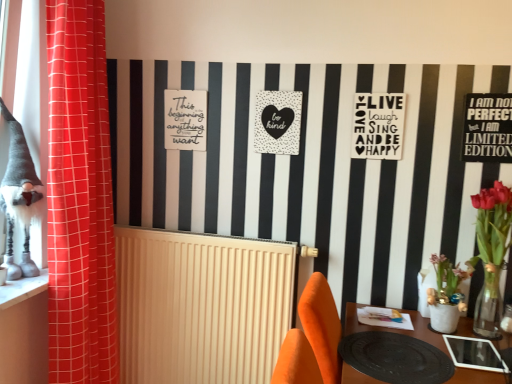
Question: From a real-world perspective, is black matte table at lower right over black matte sign at upper right, marked as the third postcard in a left-to-right arrangement?

Choices:
 (A) no
 (B) yes

Answer: (A)

Question: From a real-world perspective, is black matte table at lower right beneath black matte sign at upper right, placed as the 1th postcard when sorted from front to back?

Choices:
 (A) yes
 (B) no

Answer: (A)

Question: Would you consider black matte table at lower right to be distant from black matte sign at upper right, placed as the 1th postcard when sorted from front to back?

Choices:
 (A) yes
 (B) no

Answer: (B)

Question: From the image's perspective, does black matte table at lower right appear lower than black matte sign at upper right, placed as the 1th postcard when sorted from front to back?

Choices:
 (A) no
 (B) yes

Answer: (B)

Question: Is black matte table at lower right in contact with black matte sign at upper right, the third postcard in the back-to-front sequence?

Choices:
 (A) yes
 (B) no

Answer: (B)

Question: Considering the positions of point (92, 253) and point (170, 139), is point (92, 253) closer or farther from the camera than point (170, 139)?

Choices:
 (A) farther
 (B) closer

Answer: (B)

Question: Looking at their shapes, would you say red fabric curtain at left is wider or thinner than matte white sign at upper left?

Choices:
 (A) wide
 (B) thin

Answer: (A)

Question: In the image, is red fabric curtain at left positioned in front of or behind matte white sign at upper left?

Choices:
 (A) behind
 (B) front

Answer: (B)

Question: From the image's perspective, is red fabric curtain at left positioned above or below matte white sign at upper left?

Choices:
 (A) above
 (B) below

Answer: (B)

Question: In terms of width, does white matte poster at upper center, positioned as the second postcard in right-to-left order, look wider or thinner when compared to white stone window sill at lower left?

Choices:
 (A) wide
 (B) thin

Answer: (B)

Question: Based on their sizes in the image, would you say white matte poster at upper center, positioned as the second postcard in right-to-left order, is bigger or smaller than white stone window sill at lower left?

Choices:
 (A) small
 (B) big

Answer: (A)

Question: In the image, is white matte poster at upper center, which appears as the 2th postcard when viewed from the front, on the left side or the right side of white stone window sill at lower left?

Choices:
 (A) left
 (B) right

Answer: (B)

Question: Choose the correct answer: Is white matte poster at upper center, which appears as the 2th postcard when viewed from the front, inside white stone window sill at lower left or outside it?

Choices:
 (A) outside
 (B) inside

Answer: (A)

Question: Is point (12, 178) closer or farther from the camera than point (395, 130)?

Choices:
 (A) closer
 (B) farther

Answer: (A)

Question: Is gray fabric gnome at left bigger or smaller than white matte poster at upper center, positioned as the second postcard in right-to-left order?

Choices:
 (A) small
 (B) big

Answer: (B)